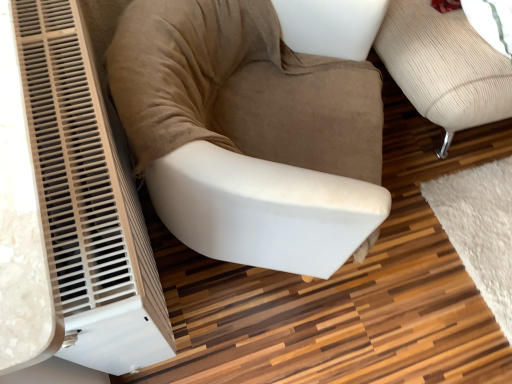
Question: Considering the relative positions of suede-like beige armchair at center-left and beige corduroy armchair at center in the image provided, is suede-like beige armchair at center-left to the left or to the right of beige corduroy armchair at center?

Choices:
 (A) left
 (B) right

Answer: (A)

Question: From the image's perspective, is suede-like beige armchair at center-left above or below beige corduroy armchair at center?

Choices:
 (A) below
 (B) above

Answer: (A)

Question: In terms of width, does suede-like beige armchair at center-left look wider or thinner when compared to beige corduroy armchair at center?

Choices:
 (A) wide
 (B) thin

Answer: (B)

Question: Does point (450, 49) appear closer or farther from the camera than point (143, 19)?

Choices:
 (A) closer
 (B) farther

Answer: (B)

Question: Choose the correct answer: Is beige corduroy armchair at center inside suede-like beige armchair at center-left or outside it?

Choices:
 (A) outside
 (B) inside

Answer: (A)

Question: From the image's perspective, relative to suede-like beige armchair at center-left, is beige corduroy armchair at center above or below?

Choices:
 (A) below
 (B) above

Answer: (B)

Question: From a real-world perspective, is beige corduroy armchair at center positioned above or below suede-like beige armchair at center-left?

Choices:
 (A) above
 (B) below

Answer: (A)